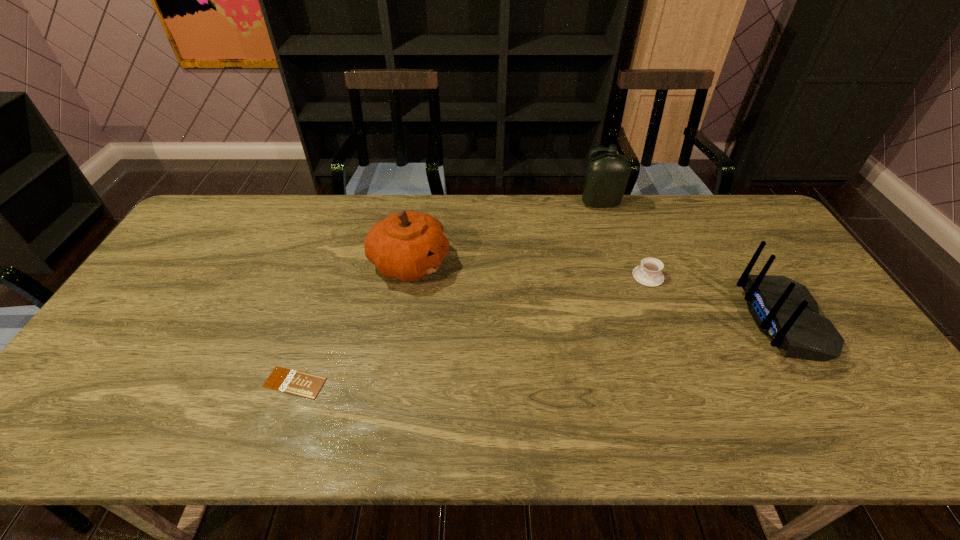
At what (x,y) coordinates should I click in order to perform the action: click on bottle. Please return your answer as a coordinate pair (x, y). Looking at the image, I should click on (606, 176).

This screenshot has width=960, height=540. Identify the location of the fourth object from right to left. (408, 245).

Where is `the rightmost object`? the rightmost object is located at coordinates (784, 310).

The height and width of the screenshot is (540, 960). Find the location of `teacup`. teacup is located at coordinates (649, 273).

You are a GUI agent. You are given a task and a screenshot of the screen. Output one action in this format:
    pyautogui.click(x=<x>, y=<y>)
    Task: Click on the nearest object
    Image resolution: width=960 pixels, height=540 pixels.
    Given the screenshot: What is the action you would take?
    pyautogui.click(x=294, y=382)

Locate an element on the screen. This screenshot has width=960, height=540. the leftmost object is located at coordinates pyautogui.click(x=294, y=382).

Find the location of a particular element. vacant space located 0.080m on the front of the bottle is located at coordinates (608, 226).

Where is `free spot located 0.190m on the front-facing side of the pumpkin`? The height and width of the screenshot is (540, 960). free spot located 0.190m on the front-facing side of the pumpkin is located at coordinates (513, 264).

Where is `free location located on the back of the rightmost object`? The height and width of the screenshot is (540, 960). free location located on the back of the rightmost object is located at coordinates (708, 320).

At what (x,y) coordinates should I click in order to perform the action: click on vacant space situated 0.230m on the back of the rightmost object. Please return your answer as a coordinate pair (x, y). The width and height of the screenshot is (960, 540). Looking at the image, I should click on (663, 320).